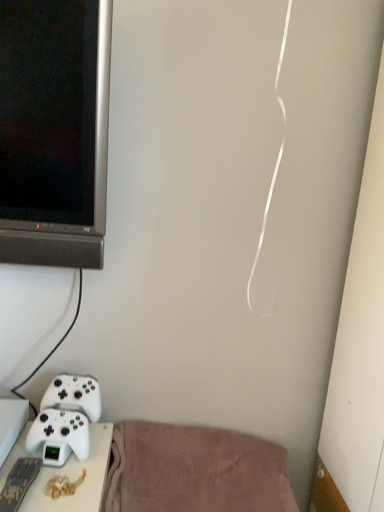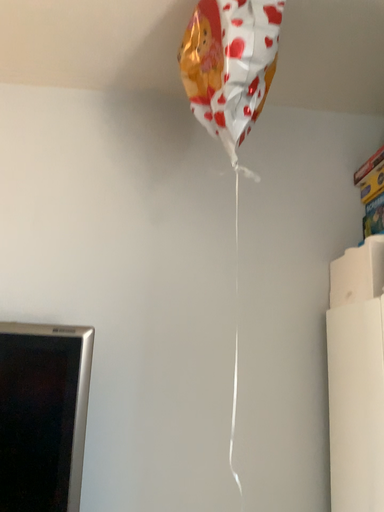
Question: Which way did the camera rotate in the video?

Choices:
 (A) rotated upward
 (B) rotated downward

Answer: (A)